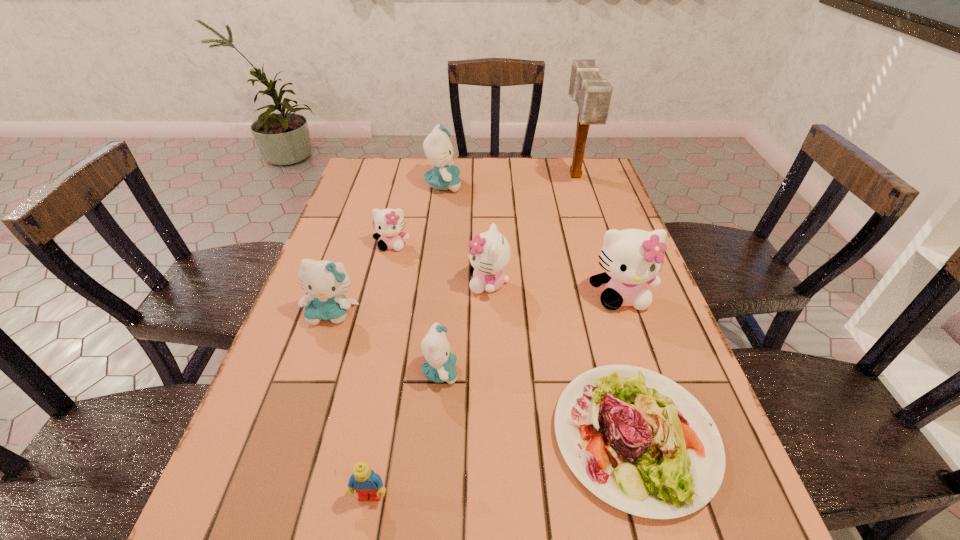
I want to click on unoccupied area between the shortest object and the farthest kitten, so click(539, 311).

Find the location of `free spot between the wood mallet and the leftmost white kitten`. free spot between the wood mallet and the leftmost white kitten is located at coordinates (484, 211).

The image size is (960, 540). In order to click on free space between the nearest blue kitten and the rightmost kitten in this screenshot , I will do `click(531, 334)`.

The image size is (960, 540). Find the location of `vacant point located between the second smallest white kitten and the smallest blue kitten`. vacant point located between the second smallest white kitten and the smallest blue kitten is located at coordinates (465, 328).

At what (x,y) coordinates should I click in order to perform the action: click on free space that is in between the salad plate and the blue Lego. Please return your answer as a coordinate pair (x, y). This screenshot has width=960, height=540. Looking at the image, I should click on (x=502, y=467).

Image resolution: width=960 pixels, height=540 pixels. In order to click on free space between the second shortest object and the green salad plate in this screenshot , I will do `click(502, 467)`.

This screenshot has width=960, height=540. In order to click on free space that is in between the second farthest kitten and the Lego in this screenshot , I will do `click(381, 370)`.

Identify the location of free point between the wood mallet and the farthest white kitten. Image resolution: width=960 pixels, height=540 pixels. (484, 211).

The image size is (960, 540). I want to click on vacant space that is in between the rightmost kitten and the wood mallet, so pyautogui.click(x=598, y=237).

Identify the location of blank region between the salad plate and the smallest blue kitten. This screenshot has height=540, width=960. click(538, 404).